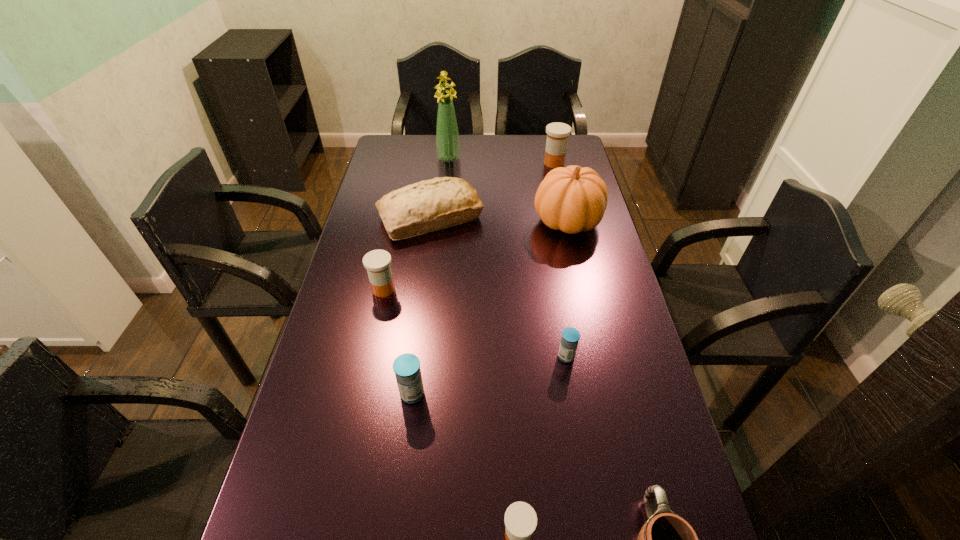
Identify which medicine is the second nearest to the bouquet. Please provide its 2D coordinates. Your answer should be formatted as a tuple, i.e. [(x, y)], where the tuple contains the x and y coordinates of a point satisfying the conditions above.

[(377, 262)]

You are a GUI agent. You are given a task and a screenshot of the screen. Output one action in this format:
    pyautogui.click(x=<x>, y=<y>)
    Task: Click on the medicine that can be found as the fourth closest to the rightmost medicine
    The image size is (960, 540).
    Given the screenshot: What is the action you would take?
    pyautogui.click(x=520, y=519)

You are a GUI agent. You are given a task and a screenshot of the screen. Output one action in this format:
    pyautogui.click(x=<x>, y=<y>)
    Task: Click on the orange medicine that is the second closest to the second farthest medicine
    
    Given the screenshot: What is the action you would take?
    pyautogui.click(x=557, y=133)

Where is `orange medicine that is the second closest to the bouquet`? This screenshot has height=540, width=960. orange medicine that is the second closest to the bouquet is located at coordinates (377, 262).

The width and height of the screenshot is (960, 540). I want to click on free spot that satisfies the following two spatial constraints: 1. on the front-facing side of the bouquet; 2. on the right side of the smaller blue medicine, so click(430, 356).